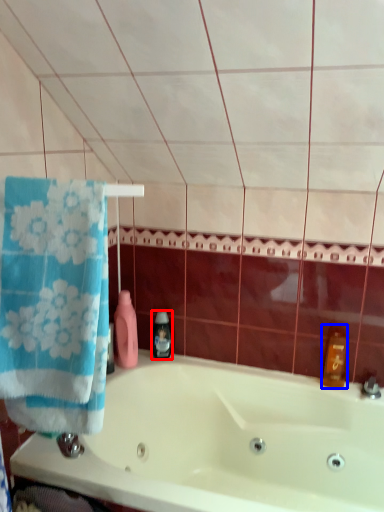
Question: Which object appears farthest to the camera in this image, soap dispenser (highlighted by a red box) or cleaning product (highlighted by a blue box)?

Choices:
 (A) soap dispenser
 (B) cleaning product

Answer: (A)